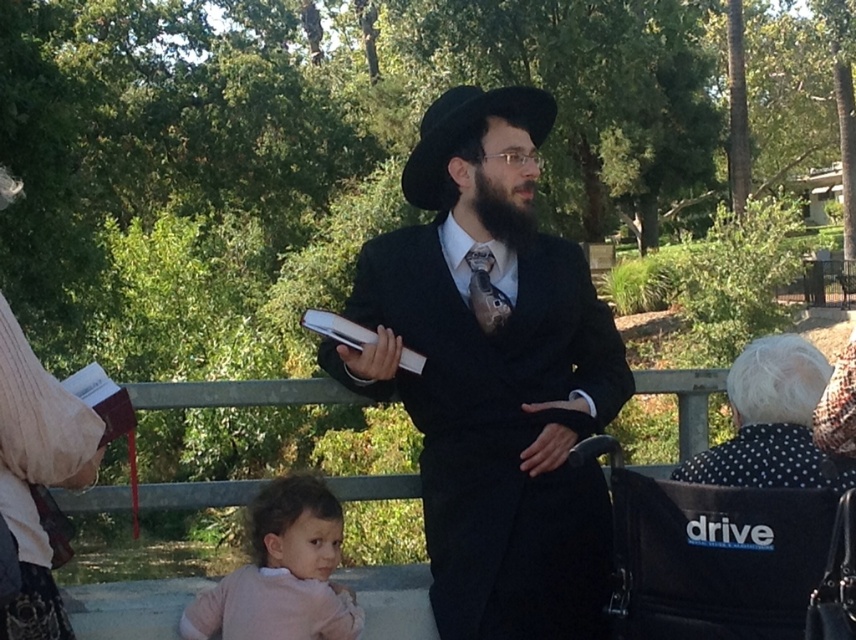
Is matte black suit at center to the left of black dotted dress at lower right from the viewer's perspective?

Correct, you'll find matte black suit at center to the left of black dotted dress at lower right.

Locate an element on the screen. matte black suit at center is located at coordinates (492, 381).

Who is more forward, (x=528, y=356) or (x=711, y=451)?

Positioned in front is point (x=711, y=451).

The width and height of the screenshot is (856, 640). Find the location of `matte black suit at center`. matte black suit at center is located at coordinates (492, 381).

Between beige knitted sweater at left and black dotted dress at lower right, which one has more height?

With more height is beige knitted sweater at left.

The height and width of the screenshot is (640, 856). In order to click on beige knitted sweater at left in this screenshot , I will do `click(37, 474)`.

The width and height of the screenshot is (856, 640). Find the location of `beige knitted sweater at left`. beige knitted sweater at left is located at coordinates (37, 474).

The height and width of the screenshot is (640, 856). Describe the element at coordinates (492, 381) in the screenshot. I see `matte black suit at center` at that location.

Is matte black suit at center to the left of pink soft fabric at lower left from the viewer's perspective?

Incorrect, matte black suit at center is not on the left side of pink soft fabric at lower left.

Is point (510, 476) closer to viewer compared to point (331, 506)?

That is True.

Identify the location of matte black suit at center. (492, 381).